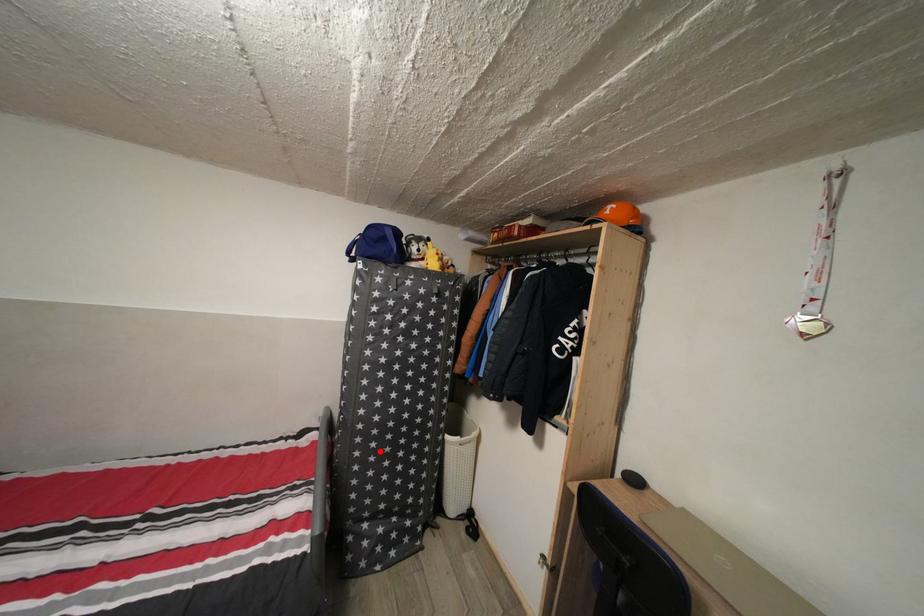
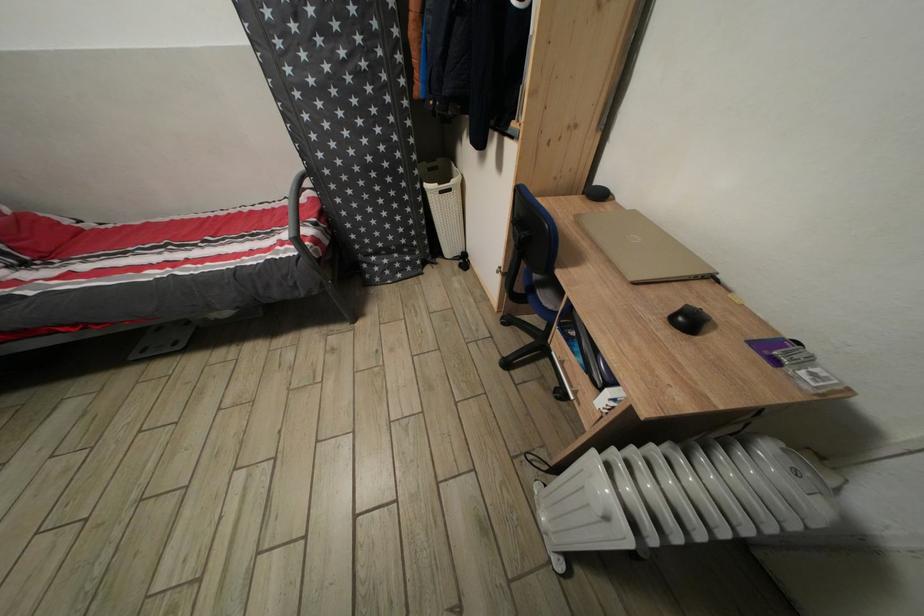
Locate, in the second image, the point that corresponds to the highlighted location in the first image.

(357, 198)